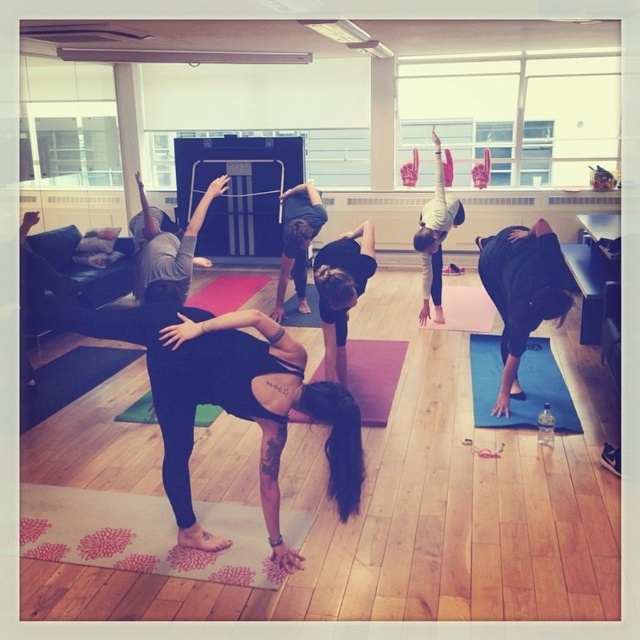
You are a yoga instructor preparing to distribute mats to students. You have two mats available in the studio, the pink floral yoga mat at lower center and the black matte yoga mat at lower right. Which mat should you choose if you need a longer one for a taller student?

The black matte yoga mat at lower right is longer than the pink floral yoga mat at lower center, so you should choose the black matte yoga mat at lower right for the taller student.

You are a yoga instructor preparing to distribute water bottles to participants. You are standing at the front of the studio and see the pink rubber yoga mat at center and the black matte leggings at center. If you want to place a water bottle between them, what is the minimum distance you need to ensure the bottle is placed between both objects?

The minimum distance you need to ensure the water bottle is placed between the pink rubber yoga mat at center and the black matte leggings at center is 1.18 meters, as they are 1.18 meters apart.